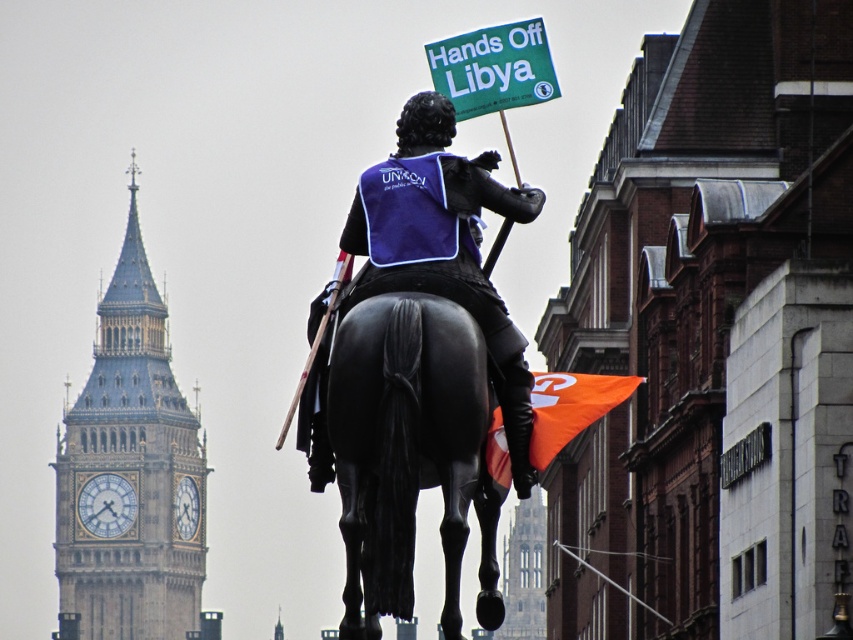
In the scene shown: You are a drone operator tasked with capturing aerial footage of the stone clock tower at left and the black polished horse at center. The drone has a maximum flight range of 250 meters. Can the drone safely film both objects without needing to recharge or return to its starting point?

The distance between the stone clock tower at left and the black polished horse at center is 252.88 meters, which exceeds the drone operator maximum flight range of 250 meters. Therefore, the drone cannot safely film both objects without needing to recharge or return to its starting point.

You are an architect analyzing the spatial layout of this historical area. Given the stone clock tower at left and the stone gothic cathedral at center, which structure has a greater horizontal span when viewed from this angle?

The stone clock tower at left has a greater horizontal span than the stone gothic cathedral at center, as its width is larger according to the description.